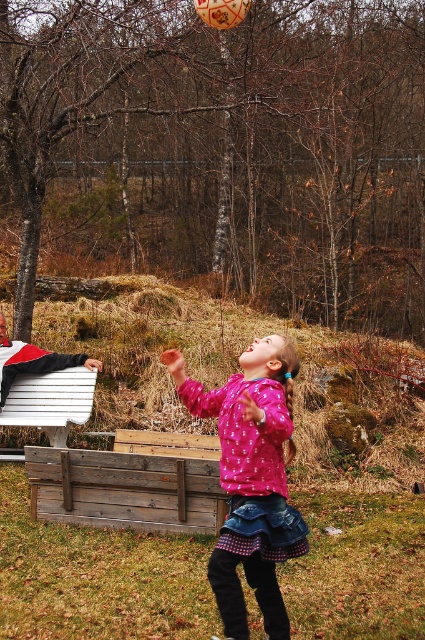
Question: Does pink matte sweater at center have a smaller size compared to white wood park bench at lower left?

Choices:
 (A) yes
 (B) no

Answer: (B)

Question: Among these points, which one is farthest from the camera?

Choices:
 (A) (31, 388)
 (B) (246, 493)

Answer: (A)

Question: Which object appears closest to the camera in this image?

Choices:
 (A) white wood park bench at lower left
 (B) pink matte sweater at center

Answer: (B)

Question: Does pink matte sweater at center come behind white wood park bench at lower left?

Choices:
 (A) no
 (B) yes

Answer: (A)

Question: Is pink matte sweater at center wider than white wood park bench at lower left?

Choices:
 (A) no
 (B) yes

Answer: (A)